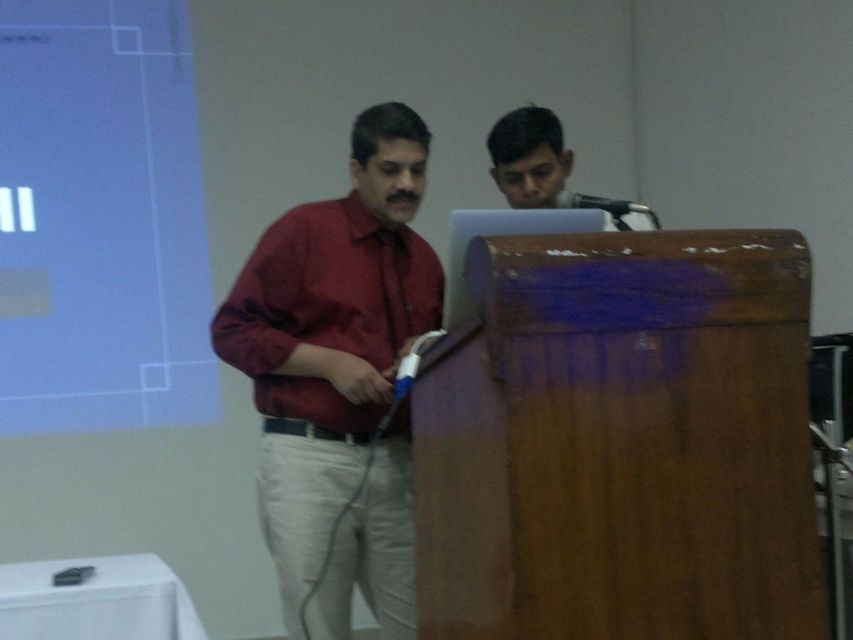
Is white matte projection screen at upper left above smooth skin face at upper center?

Correct, white matte projection screen at upper left is located above smooth skin face at upper center.

Which of these two, white matte projection screen at upper left or smooth skin face at upper center, stands taller?

white matte projection screen at upper left

I want to click on white matte projection screen at upper left, so click(x=100, y=220).

In order to click on white matte projection screen at upper left in this screenshot , I will do `click(100, 220)`.

Can you confirm if smooth skin face at upper center is shorter than black plastic microphone at center?

In fact, smooth skin face at upper center may be taller than black plastic microphone at center.

Measure the distance between point (529, 115) and camera.

They are 7.31 feet apart.

Where is `smooth skin face at upper center`? smooth skin face at upper center is located at coordinates (546, 168).

Does matte red shirt at center lie in front of black plastic microphone at center?

No, it is not.

Based on the photo, who is lower down, matte red shirt at center or black plastic microphone at center?

matte red shirt at center is lower down.

Between point (318, 236) and point (618, 218), which one is positioned behind?

Positioned behind is point (318, 236).

Locate an element on the screen. The width and height of the screenshot is (853, 640). matte red shirt at center is located at coordinates (326, 307).